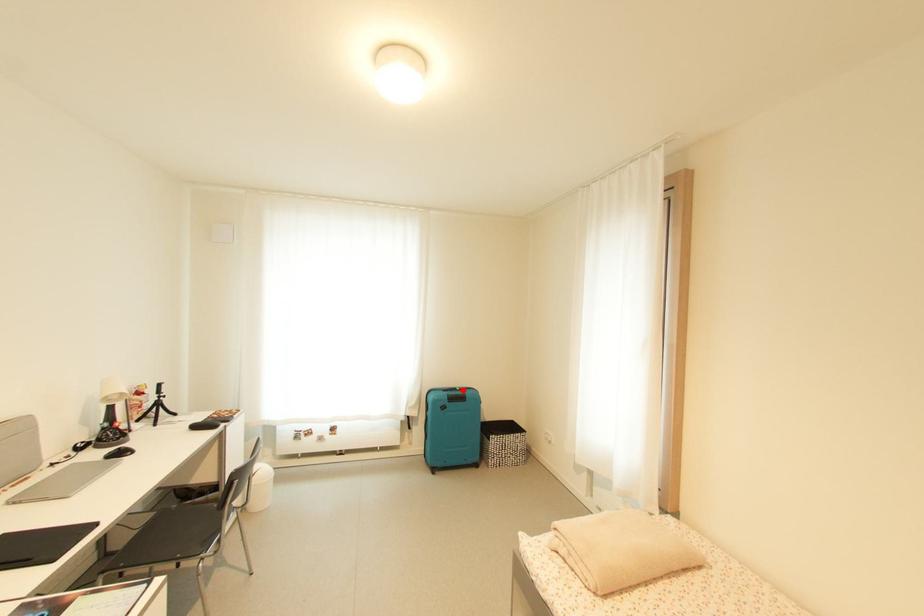
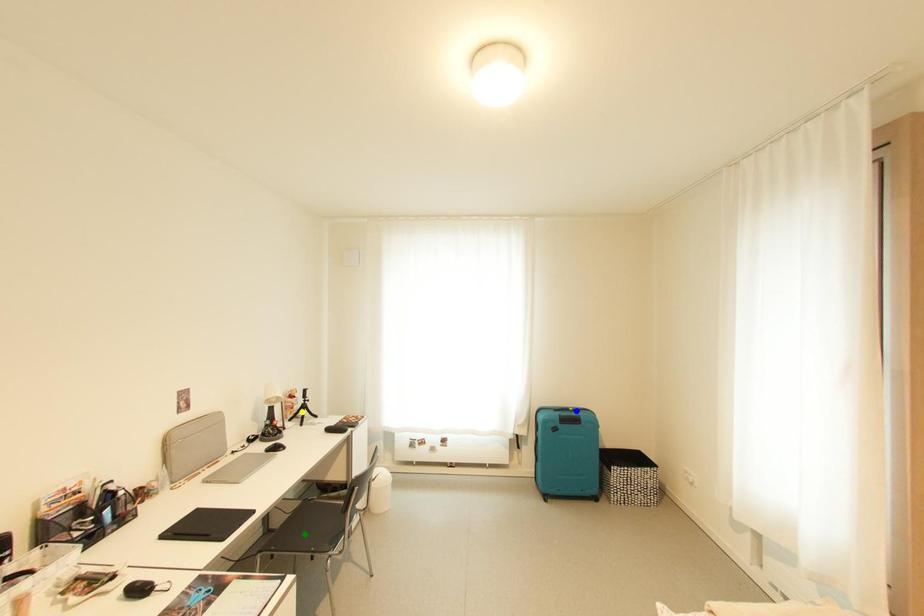
Question: I am providing you with two images of the same scene from different viewpoints. A red point is marked on the first image. You are given multiple points on the second image. Which point in image 2 represents the same 3d spot as the red point in image 1?

Choices:
 (A) yellow point
 (B) green point
 (C) blue point

Answer: (C)